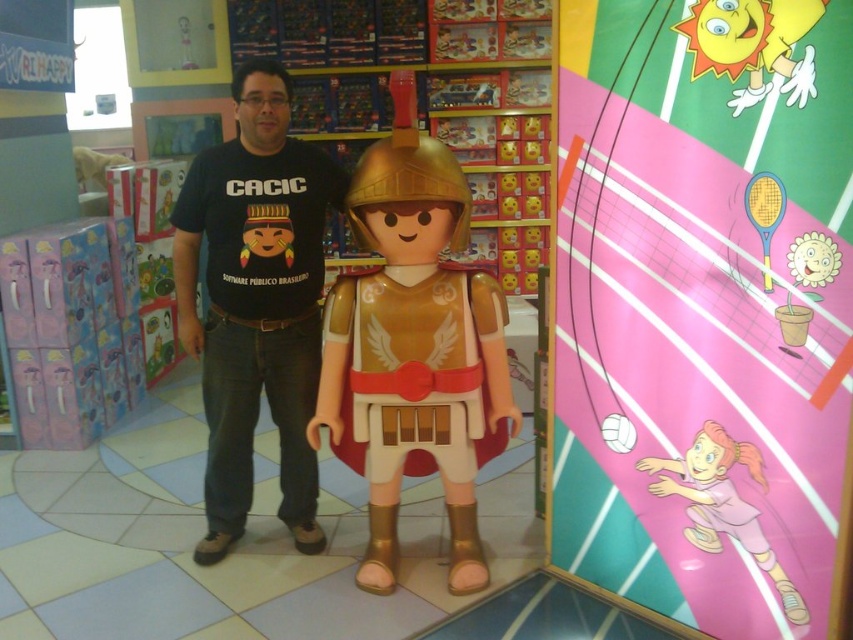
Question: Is matte gold armor at center wider than pink matte volleyball at center?

Choices:
 (A) no
 (B) yes

Answer: (B)

Question: Observing the image, what is the correct spatial positioning of matte gold armor at center in reference to black matte t-shirt at center?

Choices:
 (A) right
 (B) left

Answer: (A)

Question: Which of these objects is positioned farthest from the matte gold armor at center?

Choices:
 (A) pink matte volleyball at center
 (B) black matte t-shirt at center

Answer: (A)

Question: Can you confirm if matte gold armor at center is wider than pink matte volleyball at center?

Choices:
 (A) no
 (B) yes

Answer: (B)

Question: Estimate the real-world distances between objects in this image. Which object is farther from the black matte t-shirt at center?

Choices:
 (A) matte gold armor at center
 (B) pink matte volleyball at center

Answer: (B)

Question: Which point appears closest to the camera in this image?

Choices:
 (A) (294, 225)
 (B) (448, 486)

Answer: (A)